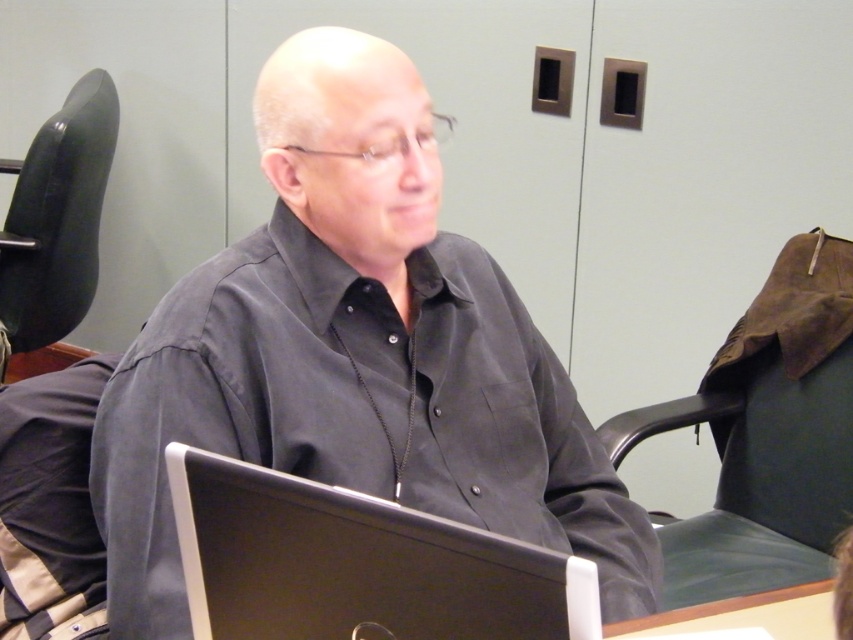
Question: Can you confirm if matte black shirt at center is positioned to the right of black leather chair at left?

Choices:
 (A) no
 (B) yes

Answer: (B)

Question: Based on their relative distances, which object is farther from the matte black shirt at center?

Choices:
 (A) black leather chair at left
 (B) wooden table at lower right
 (C) black plastic laptop at center

Answer: (A)

Question: Is matte black shirt at center smaller than wooden table at lower right?

Choices:
 (A) yes
 (B) no

Answer: (B)

Question: Based on their relative distances, which object is farther from the wooden table at lower right?

Choices:
 (A) matte black shirt at center
 (B) black plastic laptop at center

Answer: (B)

Question: Which object is positioned farthest from the wooden table at lower right?

Choices:
 (A) matte black shirt at center
 (B) black plastic laptop at center
 (C) black leather chair at left

Answer: (C)

Question: In this image, where is black leather chair at left located relative to wooden table at lower right?

Choices:
 (A) right
 (B) left

Answer: (B)